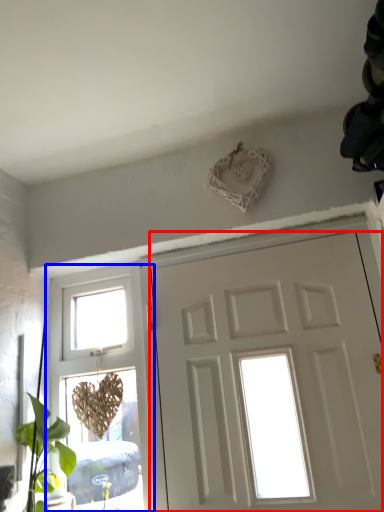
Question: Which of the following is the closest to the observer, door (highlighted by a red box) or window (highlighted by a blue box)?

Choices:
 (A) door
 (B) window

Answer: (A)